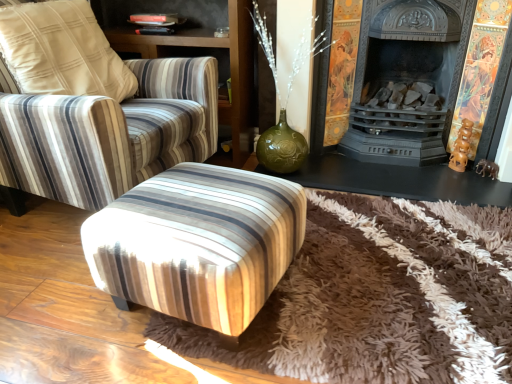
Find the location of a particular element. Image resolution: width=512 pixels, height=384 pixels. free space in front of matte black fireplace at center is located at coordinates (395, 256).